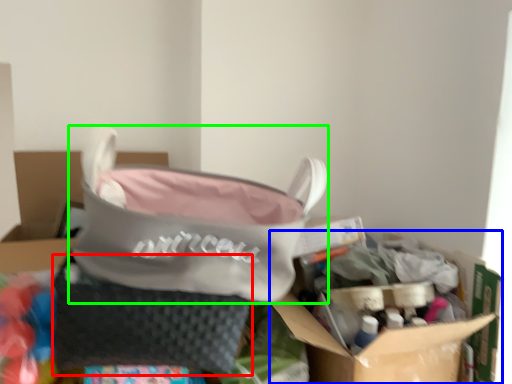
Question: Estimate the real-world distances between objects in this image. Which object is farther from pouch (highlighted by a red box), cardboard box (highlighted by a blue box) or handbag (highlighted by a green box)?

Choices:
 (A) cardboard box
 (B) handbag

Answer: (A)